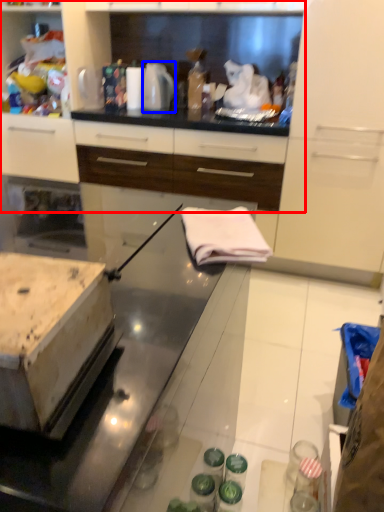
Question: Which point is further to the camera, cabinetry (highlighted by a red box) or kitchen appliance (highlighted by a blue box)?

Choices:
 (A) cabinetry
 (B) kitchen appliance

Answer: (B)